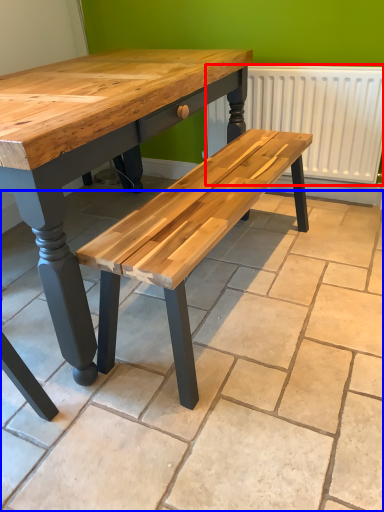
Question: Which object is further to the camera taking this photo, radiator (highlighted by a red box) or tile (highlighted by a blue box)?

Choices:
 (A) radiator
 (B) tile

Answer: (A)